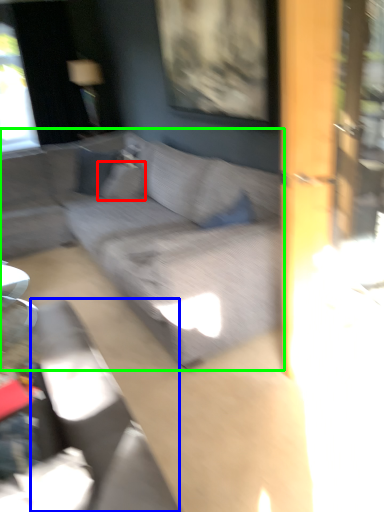
Question: Which object is positioned closest to pillow (highlighted by a red box)? Select from swivel chair (highlighted by a blue box) and studio couch (highlighted by a green box).

Choices:
 (A) swivel chair
 (B) studio couch

Answer: (B)